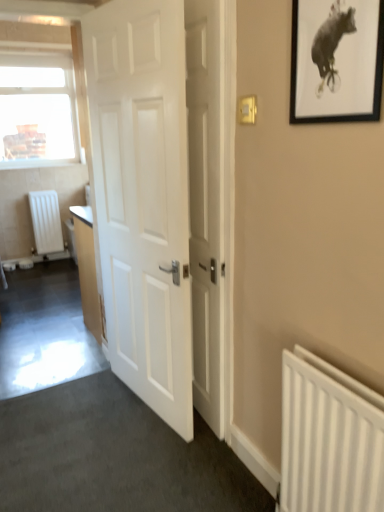
Question: Is the position of white plastic light switch at upper right more distant than that of white wooden door at center, which is the 1th door in right-to-left order?

Choices:
 (A) no
 (B) yes

Answer: (A)

Question: Is white plastic light switch at upper right wider than white wooden door at center, which is the 1th door in right-to-left order?

Choices:
 (A) no
 (B) yes

Answer: (A)

Question: Can you confirm if white plastic light switch at upper right is positioned to the right of white wooden door at center, which is the 1th door in right-to-left order?

Choices:
 (A) yes
 (B) no

Answer: (A)

Question: Is white plastic light switch at upper right taller than white wooden door at center, which is the 1th door in right-to-left order?

Choices:
 (A) no
 (B) yes

Answer: (A)

Question: Is white plastic light switch at upper right bigger than white wooden door at center, which is the 1th door in right-to-left order?

Choices:
 (A) yes
 (B) no

Answer: (B)

Question: From a real-world perspective, is white wooden door at center, the 2th door from the left, positioned above or below black matte picture frame at upper right?

Choices:
 (A) below
 (B) above

Answer: (A)

Question: From the image's perspective, is white wooden door at center, the 2th door from the left, above or below black matte picture frame at upper right?

Choices:
 (A) above
 (B) below

Answer: (B)

Question: Is white wooden door at center, the 2th door from the left, taller or shorter than black matte picture frame at upper right?

Choices:
 (A) short
 (B) tall

Answer: (B)

Question: Visually, is white wooden door at center, the 2th door from the left, positioned to the left or to the right of black matte picture frame at upper right?

Choices:
 (A) right
 (B) left

Answer: (B)

Question: In terms of height, does white matte radiator at lower right, the first radiator viewed from the right, look taller or shorter compared to clear glass window at upper left?

Choices:
 (A) tall
 (B) short

Answer: (B)

Question: Based on their positions, is white matte radiator at lower right, arranged as the first radiator when ordered from the bottom, located to the left or right of clear glass window at upper left?

Choices:
 (A) right
 (B) left

Answer: (A)

Question: Is white matte radiator at lower right, marked as the 2th radiator in a back-to-front arrangement, bigger or smaller than clear glass window at upper left?

Choices:
 (A) small
 (B) big

Answer: (A)

Question: Considering the positions of point click(x=304, y=366) and point click(x=43, y=164), is point click(x=304, y=366) closer or farther from the camera than point click(x=43, y=164)?

Choices:
 (A) farther
 (B) closer

Answer: (B)

Question: Considering the positions of point (249, 96) and point (332, 476), is point (249, 96) closer or farther from the camera than point (332, 476)?

Choices:
 (A) closer
 (B) farther

Answer: (B)

Question: In terms of height, does white plastic light switch at upper right look taller or shorter compared to white matte radiator at lower right, which is the 2th radiator in left-to-right order?

Choices:
 (A) tall
 (B) short

Answer: (B)